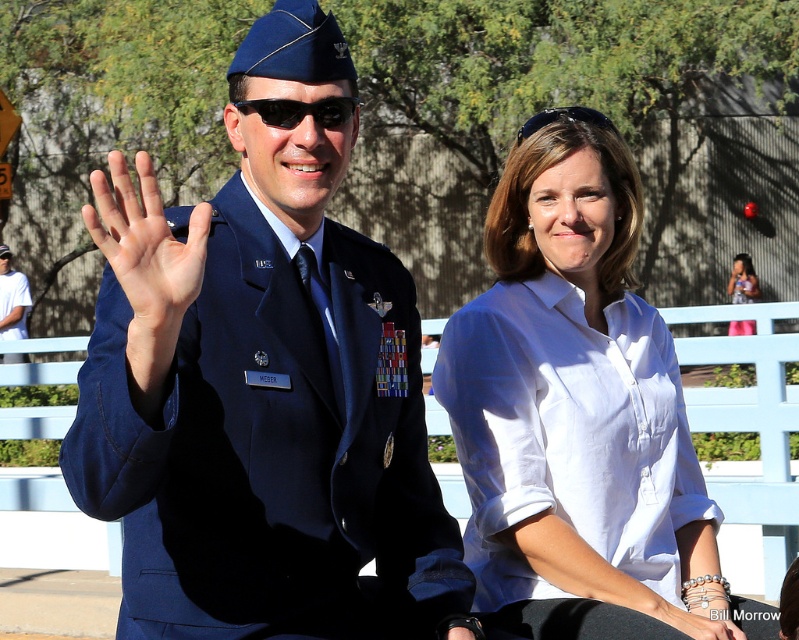
Who is shorter, matte blue uniform at center or white cotton shirt at center?

Standing shorter between the two is white cotton shirt at center.

Which is more to the left, matte blue uniform at center or white cotton shirt at center?

matte blue uniform at center

Who is more distant from viewer, (146, 586) or (602, 312)?

The point (602, 312) is behind.

Identify the location of matte blue uniform at center. The image size is (799, 640). (261, 387).

Can you confirm if light skin/soft flesh at center is thinner than white cotton shirt at upper right?

Yes, light skin/soft flesh at center is thinner than white cotton shirt at upper right.

Is light skin/soft flesh at center positioned in front of white cotton shirt at upper right?

Yes, it is in front of white cotton shirt at upper right.

Between point (197, 266) and point (734, 276), which one is positioned in front?

Positioned in front is point (197, 266).

This screenshot has height=640, width=799. I want to click on light skin/soft flesh at center, so click(x=144, y=237).

Who is higher up, white cotton shirt at center or light skin/soft flesh at center?

light skin/soft flesh at center

Who is positioned more to the right, white cotton shirt at center or light skin/soft flesh at center?

From the viewer's perspective, white cotton shirt at center appears more on the right side.

Which is in front, point (587, 259) or point (94, 241)?

Positioned in front is point (94, 241).

Where is `white cotton shirt at center`? white cotton shirt at center is located at coordinates (578, 412).